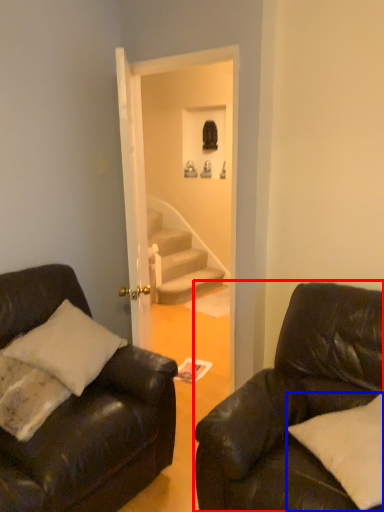
Question: Which object is further to the camera taking this photo, studio couch (highlighted by a red box) or pillow (highlighted by a blue box)?

Choices:
 (A) studio couch
 (B) pillow

Answer: (B)